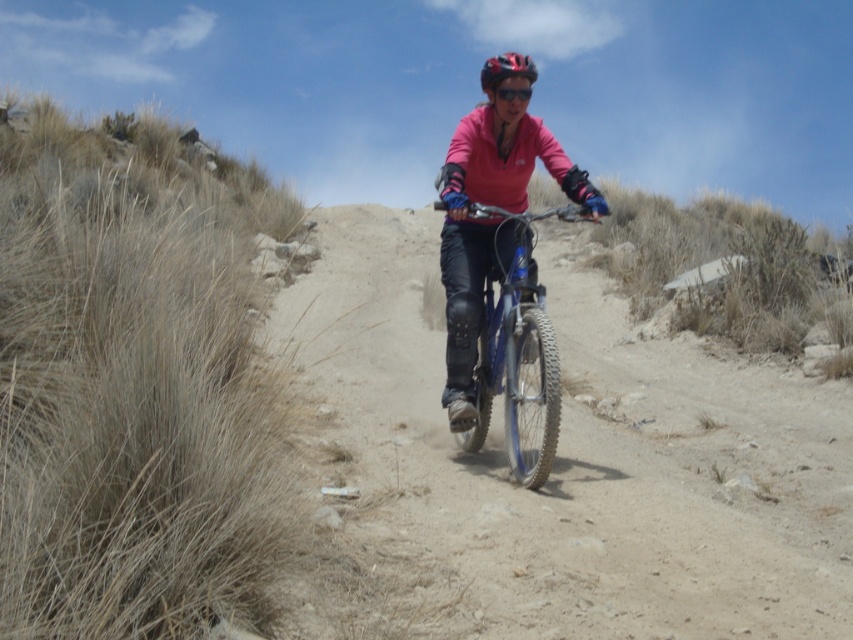
You are a photographer trying to capture the rider and their gear. You notice the blue metallic bicycle at center and the shiny red helmet at center. Which object would you need to adjust your camera focus on first if you want to take a photo where both are in focus, considering their sizes?

The blue metallic bicycle at center is smaller than the shiny red helmet at center, so you should focus on the smaller object first to ensure both are in focus.

You are a photographer standing at the camera position. You want to place a marker at the point exactly 5 meters away from your current position. Is the point labeled as point [509,307] in the image the correct location for the marker?

The point labeled as point [509,307] is exactly 5.06 meters from the camera, so it is slightly further than 5 meters. Therefore, it is not the correct location for the marker.

You are a photographer trying to capture the rider and their gear. You need to know the relative positions of the blue metallic bicycle at center and the shiny red helmet at center to frame your shot. Which object is located to the left of the other?

The blue metallic bicycle at center is positioned on the left side of the shiny red helmet at center.